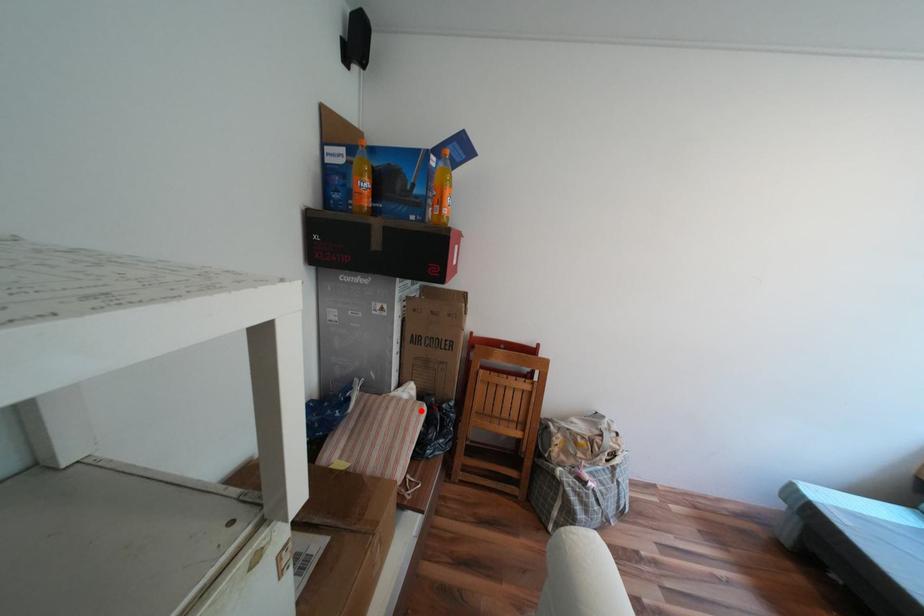
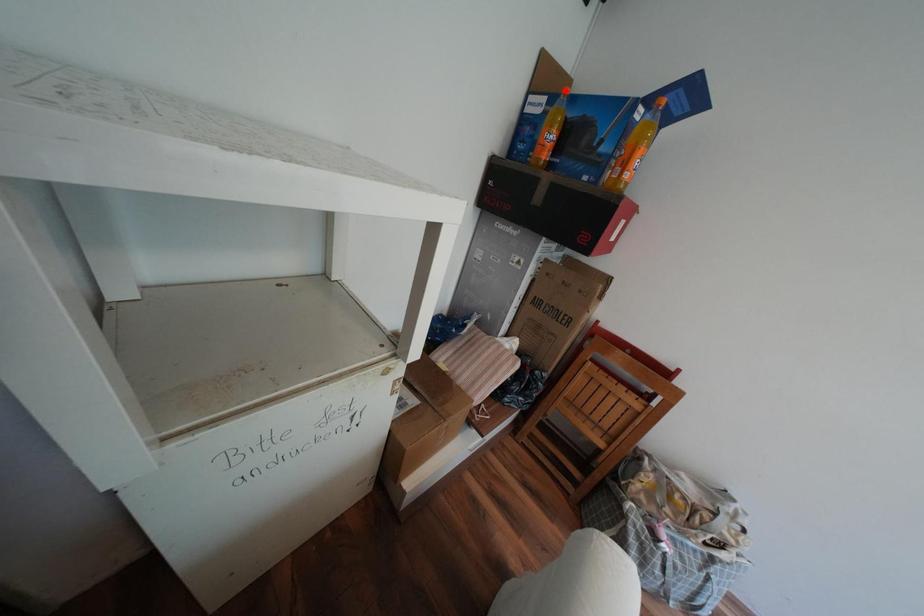
I am providing you with two images of the same scene from different viewpoints. A red point is marked on the first image and another point is marked on the second image. Is the red point in image1 aligned with the point shown in image2?

No